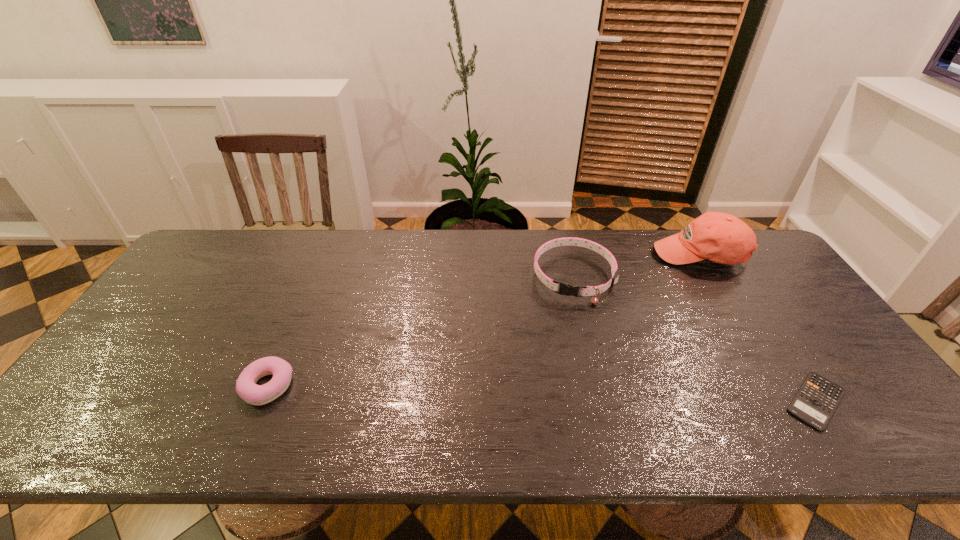
Find the location of a particular element. The image size is (960, 540). pastry is located at coordinates (246, 387).

I want to click on the leftmost object, so click(246, 387).

Find the location of a particular element. The image size is (960, 540). calculator is located at coordinates (817, 399).

Where is `baseball cap`? This screenshot has width=960, height=540. baseball cap is located at coordinates (719, 237).

Where is `dog collar`? This screenshot has height=540, width=960. dog collar is located at coordinates (566, 289).

The image size is (960, 540). I want to click on the third object from right to left, so click(x=566, y=289).

Locate an element on the screen. This screenshot has width=960, height=540. vacant space situated on the back of the pastry is located at coordinates (287, 340).

You are a GUI agent. You are given a task and a screenshot of the screen. Output one action in this format:
    pyautogui.click(x=<x>, y=<y>)
    Task: Click on the free space located 0.310m on the left of the shortest object
    This screenshot has height=540, width=960.
    Given the screenshot: What is the action you would take?
    pyautogui.click(x=649, y=401)

Where is `vacant space situated on the front-facing side of the tallest object`? The height and width of the screenshot is (540, 960). vacant space situated on the front-facing side of the tallest object is located at coordinates (659, 306).

Identify the location of vacant space positioned on the front-facing side of the tallest object. (673, 282).